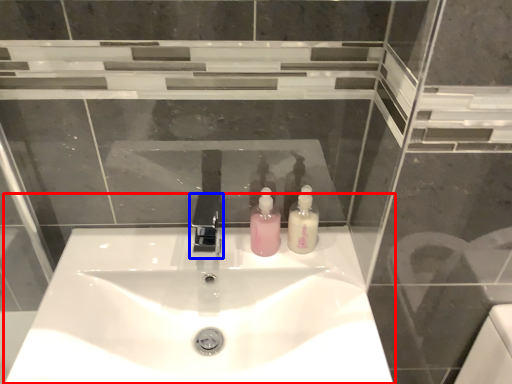
Question: Which of the following is the closest to the observer, sink (highlighted by a red box) or tap (highlighted by a blue box)?

Choices:
 (A) sink
 (B) tap

Answer: (A)